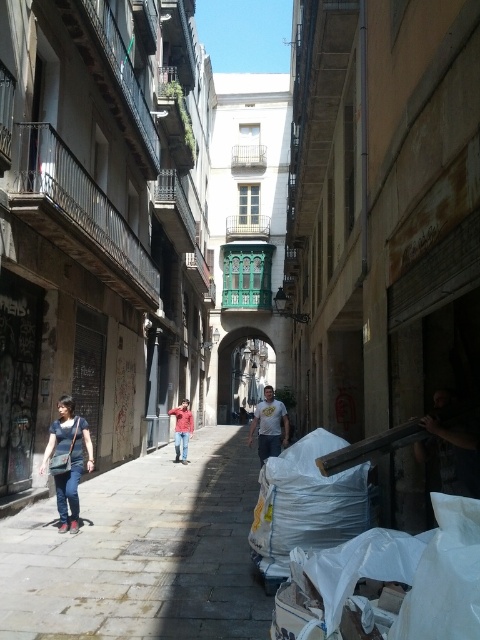
You are a delivery person carrying a package and need to walk through the narrow alleyway. You see the gray stone pavement at center and the denim jeans at lower left. Which path is wider for you to walk safely?

The gray stone pavement at center is wider than the denim jeans at lower left, so you should choose the gray stone pavement at center to walk safely.